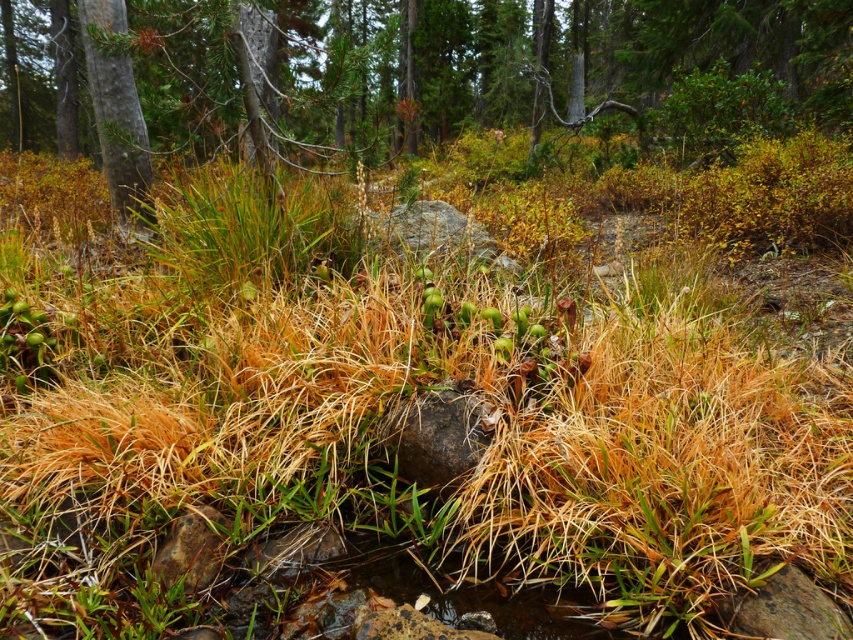
Can you confirm if green matte tree at center is thinner than green textured tree at upper left?

No.

The height and width of the screenshot is (640, 853). I want to click on green matte tree at center, so click(x=553, y=68).

The height and width of the screenshot is (640, 853). Identify the location of green matte tree at center. click(x=553, y=68).